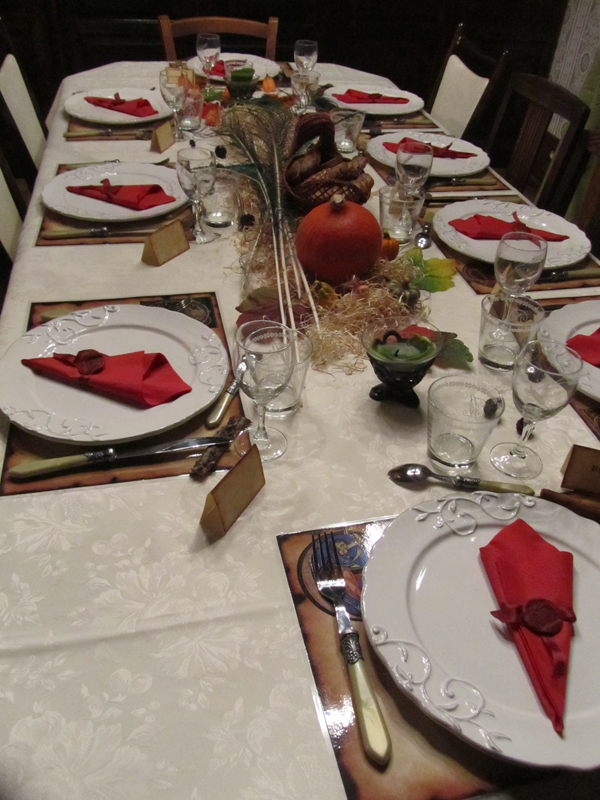
This screenshot has height=800, width=600. Identify the location of plates. (451, 606), (162, 337), (575, 318), (562, 256), (449, 165), (389, 108), (264, 62), (81, 108), (71, 198).